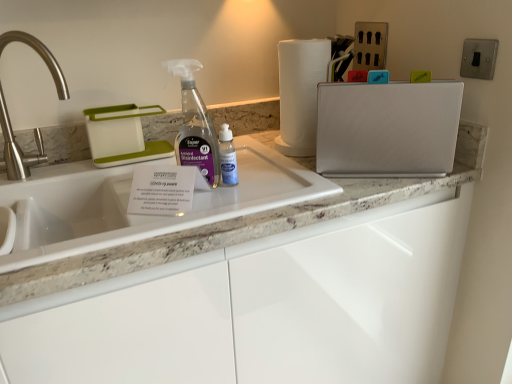
Question: From a real-world perspective, is metallic switch at upper right physically located above or below white textured cutting board at upper right, which ranks as the 2th appliance in left-to-right order?

Choices:
 (A) above
 (B) below

Answer: (A)

Question: Relative to white textured cutting board at upper right, which ranks as the 2th appliance in left-to-right order, is metallic switch at upper right in front or behind?

Choices:
 (A) behind
 (B) front

Answer: (A)

Question: Considering the real-world distances, which object is closest to the brushed metal faucet at left?

Choices:
 (A) white textured cutting board at upper right, positioned as the first appliance in right-to-left order
 (B) white paper towel at upper right
 (C) white plastic dish rack at upper left, the first appliance viewed from the left
 (D) white marble countertop at center
 (E) metallic switch at upper right

Answer: (C)

Question: Estimate the real-world distances between objects in this image. Which object is farther from the brushed metal faucet at left?

Choices:
 (A) white plastic dish rack at upper left, which is counted as the second appliance, starting from the right
 (B) metallic switch at upper right
 (C) white paper towel at upper right
 (D) white marble countertop at center
 (E) white textured cutting board at upper right, positioned as the first appliance in right-to-left order

Answer: (B)